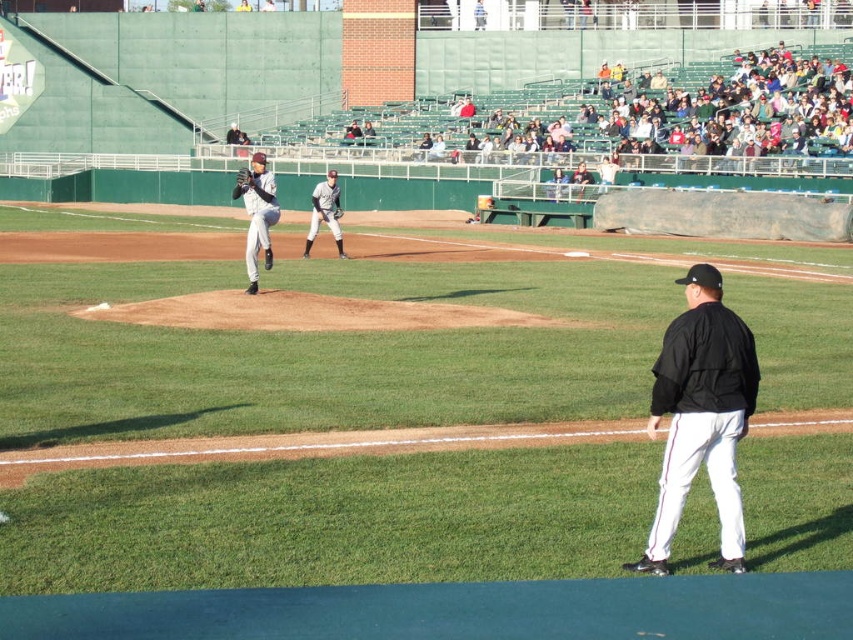
Which is more to the right, gray uniformed player at center or dark gray leather glove at center?

gray uniformed player at center

Is point (306, 237) farther from camera compared to point (242, 182)?

That is True.

Where is `gray uniformed player at center`? gray uniformed player at center is located at coordinates (325, 212).

Between black matte jacket at right and gray uniformed pitcher at center, which one appears on the left side from the viewer's perspective?

From the viewer's perspective, gray uniformed pitcher at center appears more on the left side.

The width and height of the screenshot is (853, 640). Describe the element at coordinates (701, 416) in the screenshot. I see `black matte jacket at right` at that location.

The width and height of the screenshot is (853, 640). Find the location of `black matte jacket at right`. black matte jacket at right is located at coordinates (701, 416).

Is gray uniformed pitcher at center wider than white baseball cap at upper center?

Correct, the width of gray uniformed pitcher at center exceeds that of white baseball cap at upper center.

Is point (260, 230) farther from viewer compared to point (233, 140)?

No, (260, 230) is closer to viewer.

Does point (263, 168) come in front of point (225, 131)?

Yes, it is.

Locate an element on the screen. Image resolution: width=853 pixels, height=640 pixels. gray uniformed pitcher at center is located at coordinates [257, 214].